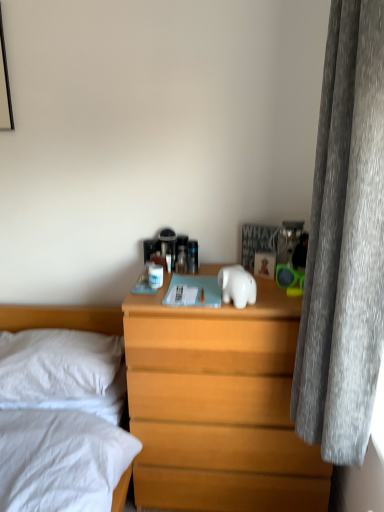
Question: Is wooden nightstand at center placed right next to white soft pillow at left?

Choices:
 (A) yes
 (B) no

Answer: (B)

Question: Considering the relative sizes of wooden nightstand at center and white soft pillow at left in the image provided, is wooden nightstand at center thinner than white soft pillow at left?

Choices:
 (A) no
 (B) yes

Answer: (A)

Question: Is wooden nightstand at center smaller than white soft pillow at left?

Choices:
 (A) no
 (B) yes

Answer: (A)

Question: From the image's perspective, is wooden nightstand at center located beneath white soft pillow at left?

Choices:
 (A) yes
 (B) no

Answer: (A)

Question: Is wooden nightstand at center facing away from white soft pillow at left?

Choices:
 (A) no
 (B) yes

Answer: (A)

Question: Does wooden nightstand at center appear on the right side of white soft pillow at left?

Choices:
 (A) no
 (B) yes

Answer: (B)

Question: Is wooden nightstand at center facing away from white glossy elephant at center?

Choices:
 (A) no
 (B) yes

Answer: (A)

Question: Is the depth of wooden nightstand at center greater than that of white glossy elephant at center?

Choices:
 (A) yes
 (B) no

Answer: (A)

Question: Can you confirm if wooden nightstand at center is positioned to the left of white glossy elephant at center?

Choices:
 (A) yes
 (B) no

Answer: (B)

Question: Considering the relative sizes of wooden nightstand at center and white glossy elephant at center in the image provided, is wooden nightstand at center thinner than white glossy elephant at center?

Choices:
 (A) no
 (B) yes

Answer: (A)

Question: Could white glossy elephant at center be considered to be inside wooden nightstand at center?

Choices:
 (A) yes
 (B) no

Answer: (B)

Question: From a real-world perspective, does wooden nightstand at center sit lower than white glossy elephant at center?

Choices:
 (A) yes
 (B) no

Answer: (A)

Question: Can you confirm if white glossy elephant at center is taller than gray velvet curtain at right?

Choices:
 (A) yes
 (B) no

Answer: (B)